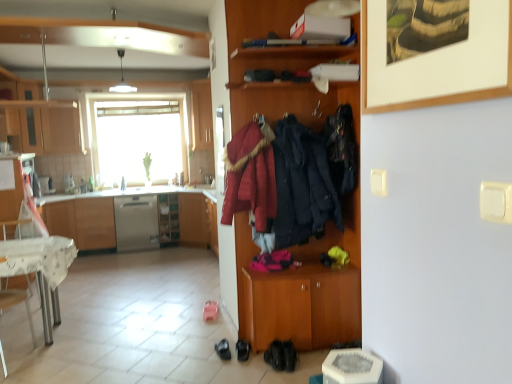
Where is `vacant area that is situated to the right of black leather shoes at lower center, which appears as the first footwear when viewed from the right`? This screenshot has height=384, width=512. vacant area that is situated to the right of black leather shoes at lower center, which appears as the first footwear when viewed from the right is located at coordinates (311, 359).